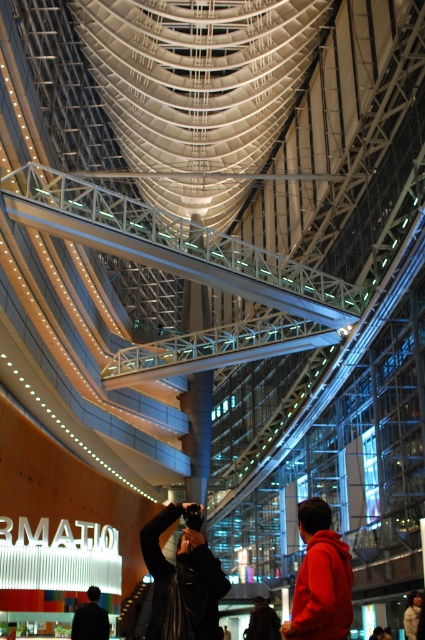
Question: Does black matte jacket at center come behind red fleece jacket at center?

Choices:
 (A) no
 (B) yes

Answer: (B)

Question: Which object appears farthest from the camera in this image?

Choices:
 (A) red fleece jacket at center
 (B) dark brown leather jacket at lower center
 (C) black matte jacket at center

Answer: (B)

Question: Which point appears farthest from the camera in this image?

Choices:
 (A) (305, 576)
 (B) (173, 572)
 (C) (416, 600)

Answer: (C)

Question: Where is red fleece jacket at center located in relation to dark brown leather jacket at lower right in the image?

Choices:
 (A) below
 (B) above

Answer: (B)

Question: Which object is positioned farthest from the dark brown leather jacket at lower right?

Choices:
 (A) dark blue jacket at lower left
 (B) black matte jacket at center
 (C) red fleece jacket at center
 (D) dark brown leather jacket at lower center

Answer: (A)

Question: Is black matte jacket at center bigger than dark brown leather jacket at lower right?

Choices:
 (A) yes
 (B) no

Answer: (A)